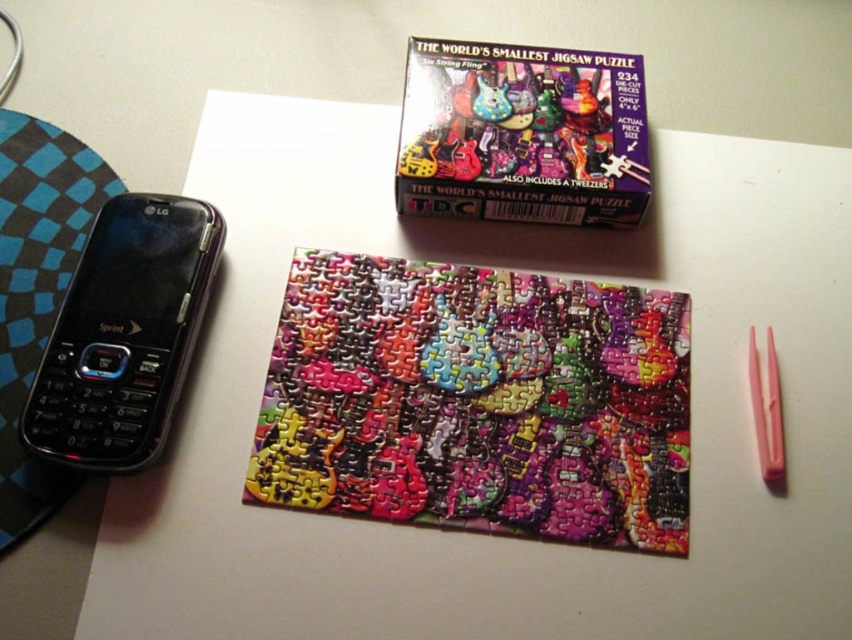
Question: Can you confirm if multicolored plastic box at upper center is bigger than black plastic phone at left?

Choices:
 (A) yes
 (B) no

Answer: (A)

Question: Can you confirm if multicolored puzzle at center is wider than multicolored plastic box at upper center?

Choices:
 (A) yes
 (B) no

Answer: (A)

Question: Estimate the real-world distances between objects in this image. Which object is farther from the multicolored puzzle at center?

Choices:
 (A) multicolored plastic box at upper center
 (B) black plastic phone at left

Answer: (B)

Question: Which object is farther from the camera taking this photo?

Choices:
 (A) black plastic phone at left
 (B) multicolored plastic box at upper center

Answer: (B)

Question: Estimate the real-world distances between objects in this image. Which object is closer to the multicolored plastic box at upper center?

Choices:
 (A) black plastic phone at left
 (B) multicolored puzzle at center

Answer: (B)

Question: Does multicolored plastic box at upper center appear on the right side of black plastic phone at left?

Choices:
 (A) yes
 (B) no

Answer: (A)